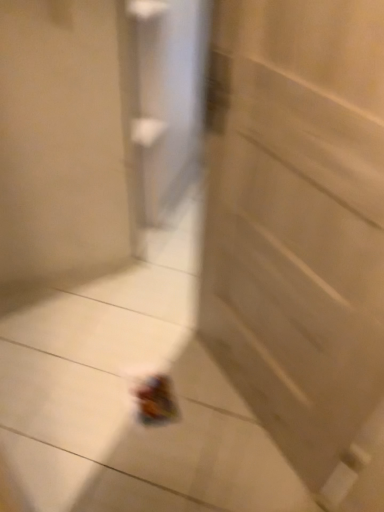
The width and height of the screenshot is (384, 512). Identify the location of white matte door at center. (299, 224).

Image resolution: width=384 pixels, height=512 pixels. Describe the element at coordinates (299, 224) in the screenshot. I see `white matte door at center` at that location.

Locate an element on the screen. Image resolution: width=384 pixels, height=512 pixels. white matte door at center is located at coordinates (299, 224).